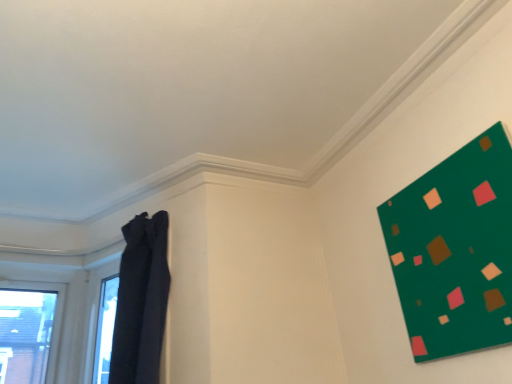
Question: Would you say dark fabric curtain at left contains green matte board at upper right?

Choices:
 (A) yes
 (B) no

Answer: (B)

Question: Can you confirm if dark fabric curtain at left is taller than green matte board at upper right?

Choices:
 (A) no
 (B) yes

Answer: (B)

Question: Can you confirm if dark fabric curtain at left is thinner than green matte board at upper right?

Choices:
 (A) no
 (B) yes

Answer: (A)

Question: Does dark fabric curtain at left come in front of green matte board at upper right?

Choices:
 (A) no
 (B) yes

Answer: (A)

Question: Is dark fabric curtain at left facing towards green matte board at upper right?

Choices:
 (A) yes
 (B) no

Answer: (B)

Question: Does dark fabric curtain at left appear on the left side of green matte board at upper right?

Choices:
 (A) yes
 (B) no

Answer: (A)

Question: Can you confirm if green matte board at upper right is taller than dark fabric curtain at left?

Choices:
 (A) no
 (B) yes

Answer: (A)

Question: Is dark fabric curtain at left inside green matte board at upper right?

Choices:
 (A) no
 (B) yes

Answer: (A)

Question: Could you tell me if green matte board at upper right is facing dark fabric curtain at left?

Choices:
 (A) yes
 (B) no

Answer: (B)

Question: Considering the relative sizes of green matte board at upper right and dark fabric curtain at left in the image provided, is green matte board at upper right bigger than dark fabric curtain at left?

Choices:
 (A) yes
 (B) no

Answer: (B)

Question: From the image's perspective, is green matte board at upper right above dark fabric curtain at left?

Choices:
 (A) no
 (B) yes

Answer: (B)

Question: Is green matte board at upper right closer to the viewer compared to dark fabric curtain at left?

Choices:
 (A) no
 (B) yes

Answer: (B)

Question: In terms of height, does green matte board at upper right look taller or shorter compared to dark fabric curtain at left?

Choices:
 (A) tall
 (B) short

Answer: (B)